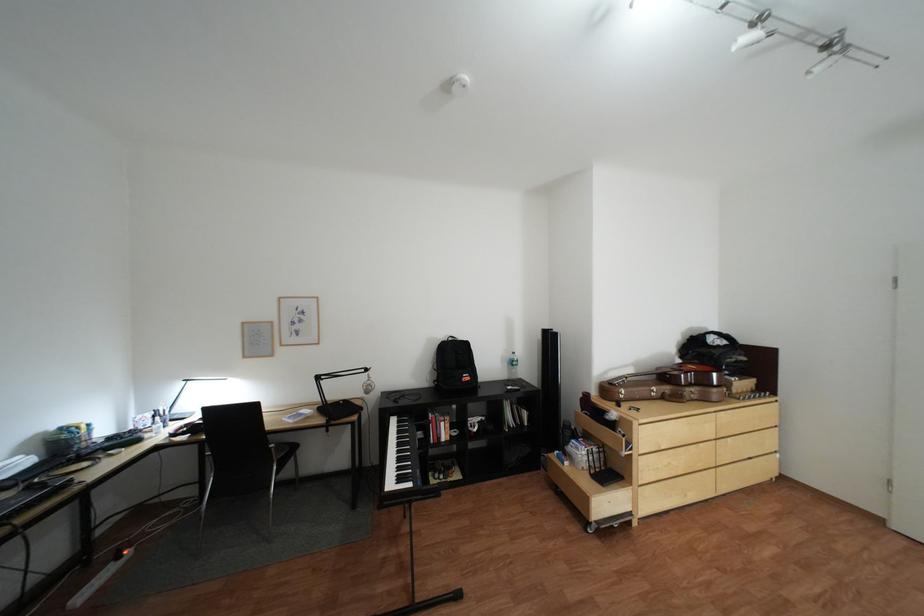
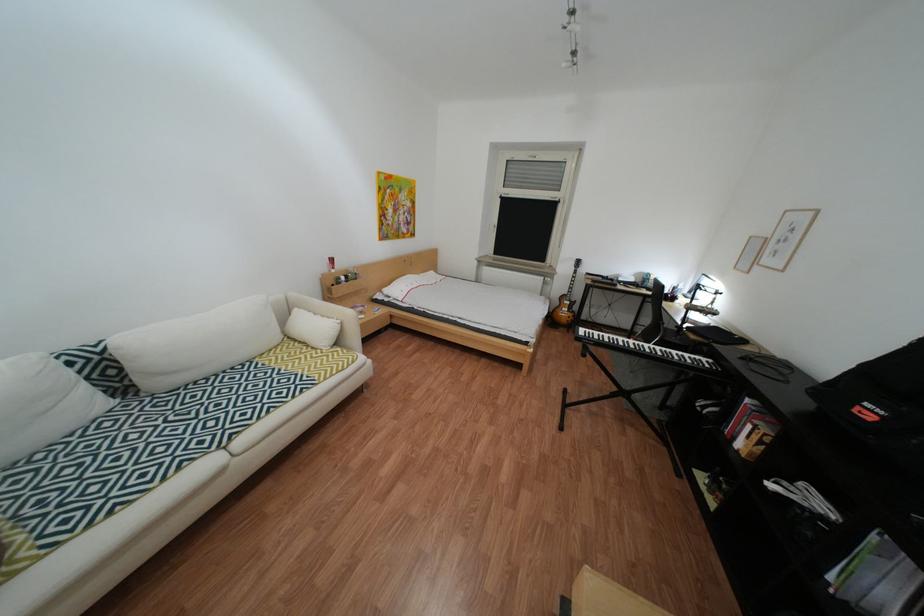
In the second image, find the point that corresponds to the point at 456,439 in the first image.

(749, 439)